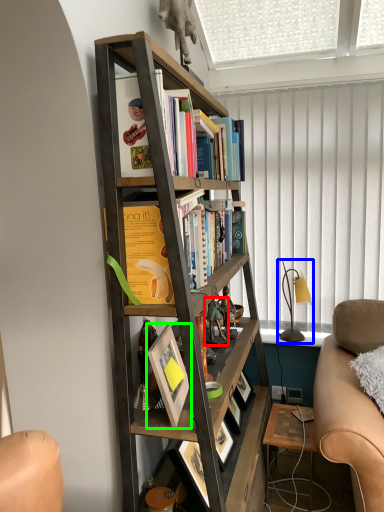
Question: Based on their relative distances, which object is nearer to toy (highlighted by a red box)? Choose from table lamp (highlighted by a blue box) and picture frame (highlighted by a green box).

Choices:
 (A) table lamp
 (B) picture frame

Answer: (B)